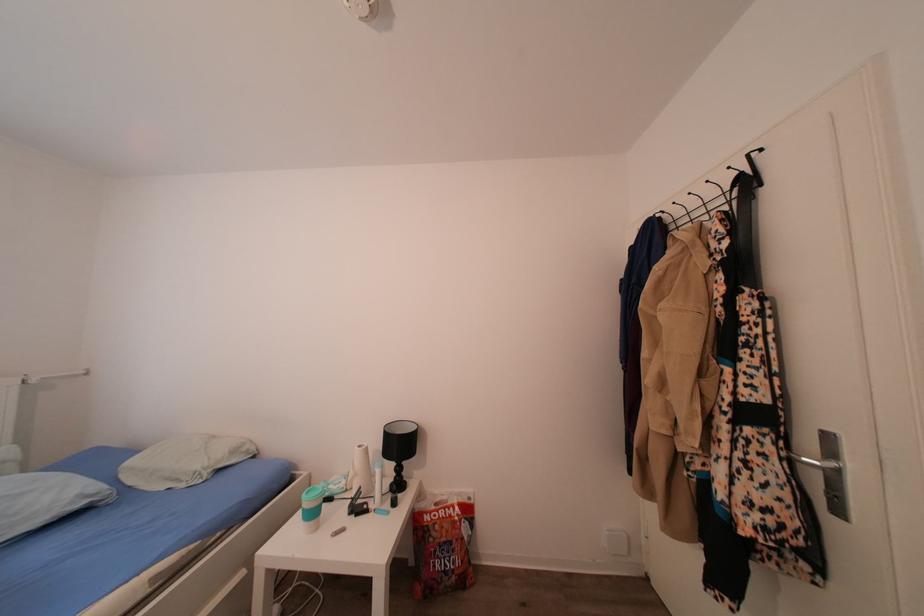
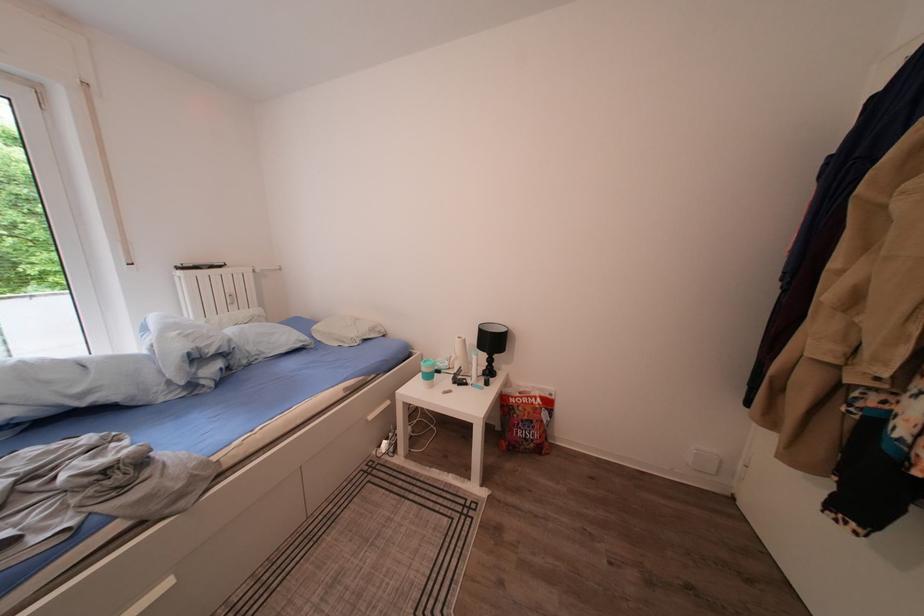
In the second image, find the point that corresponds to pixel 312 501 in the first image.

(431, 369)